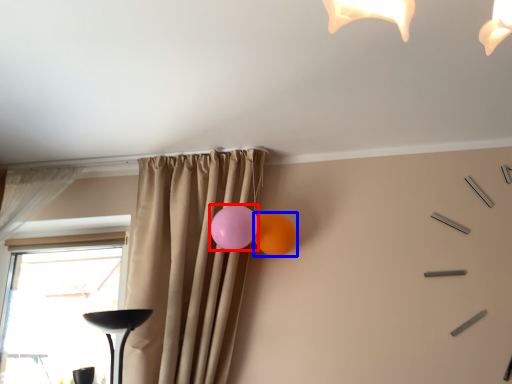
Question: Which of the following is the closest to the observer, balloon (highlighted by a red box) or balloon (highlighted by a blue box)?

Choices:
 (A) balloon
 (B) balloon

Answer: (A)